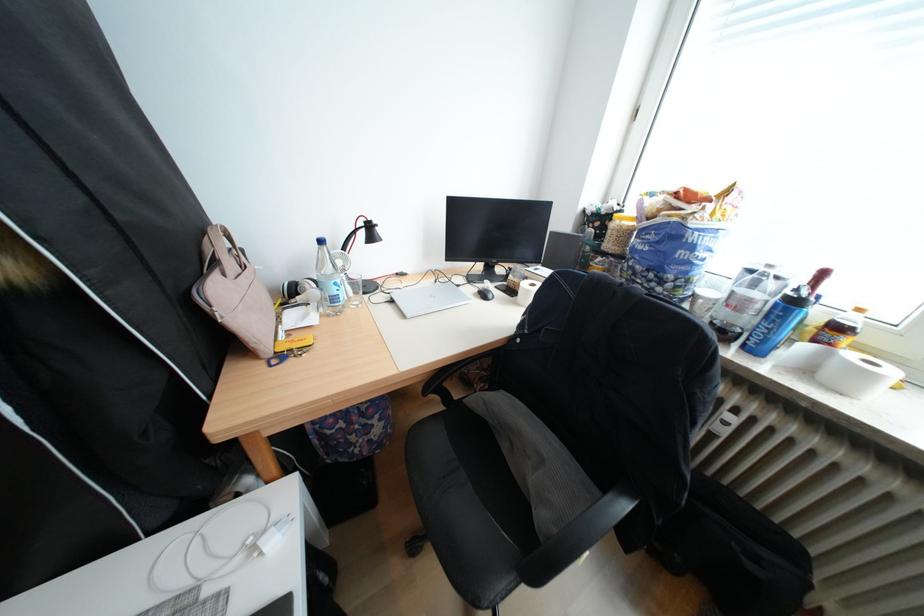
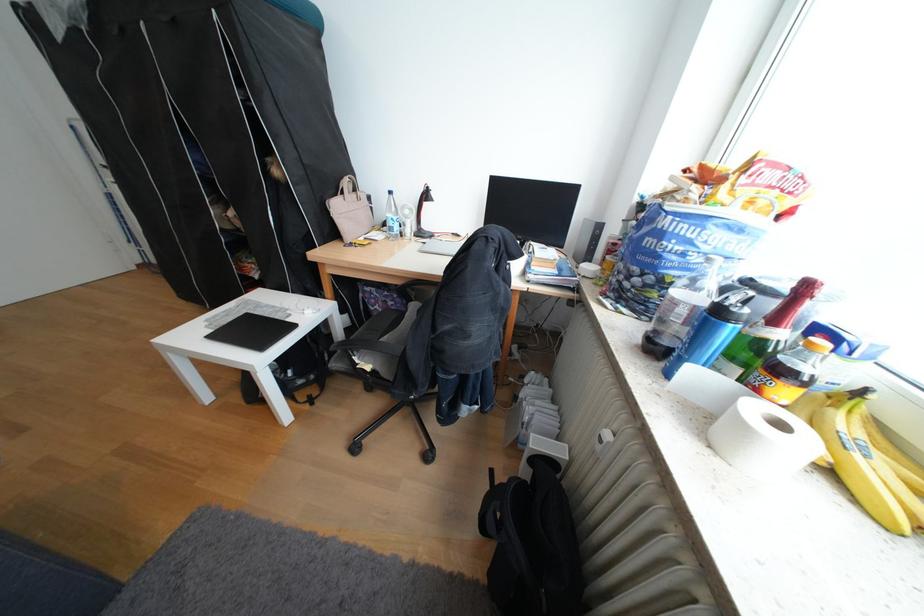
Find the pixel in the second image that matches (227,264) in the first image.

(355, 193)